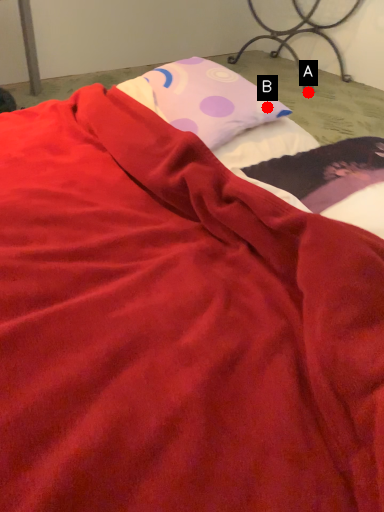
Question: Two points are circled on the image, labeled by A and B beside each circle. Which point is closer to the camera?

Choices:
 (A) A is closer
 (B) B is closer

Answer: (B)